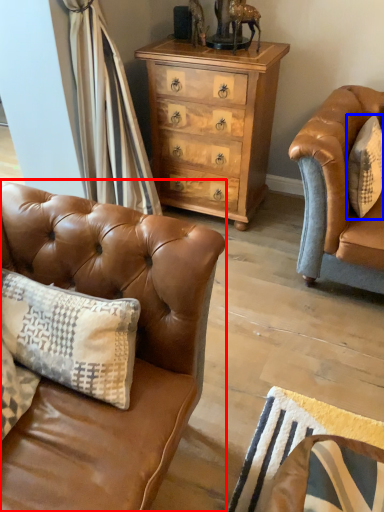
Question: Which point is further to the camera, studio couch (highlighted by a red box) or pillow (highlighted by a blue box)?

Choices:
 (A) studio couch
 (B) pillow

Answer: (B)